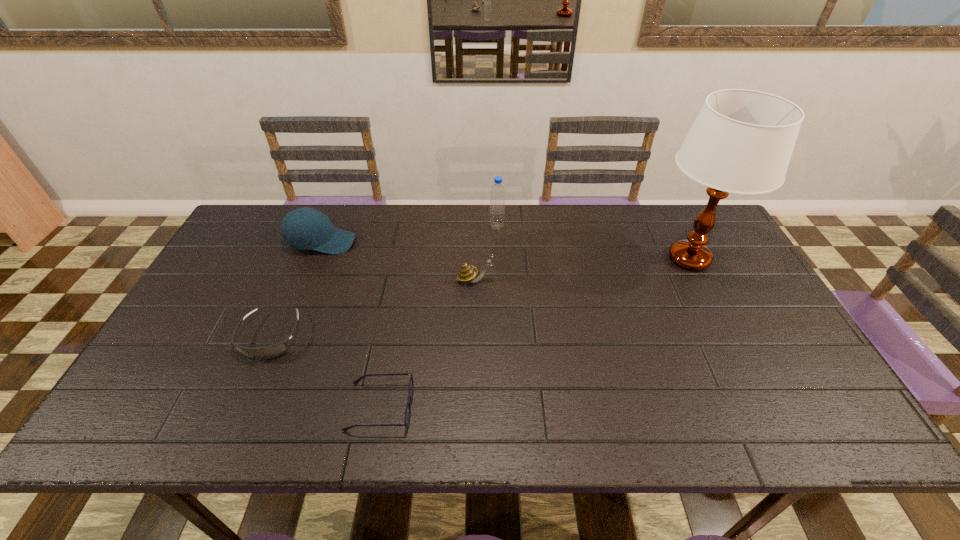
In order to click on table lamp in this screenshot , I will do `click(741, 142)`.

Where is `the rightmost object`? This screenshot has height=540, width=960. the rightmost object is located at coordinates (741, 142).

The height and width of the screenshot is (540, 960). In order to click on water bottle in this screenshot , I will do `click(497, 194)`.

Where is `baseball cap`? Image resolution: width=960 pixels, height=540 pixels. baseball cap is located at coordinates (305, 228).

I want to click on snail, so click(x=467, y=273).

You are a GUI agent. You are given a task and a screenshot of the screen. Output one action in this format:
    pyautogui.click(x=<x>, y=<y>)
    Task: Click on the second nearest object
    The height and width of the screenshot is (540, 960).
    Given the screenshot: What is the action you would take?
    pyautogui.click(x=271, y=351)

This screenshot has width=960, height=540. Identify the location of the nearest object. (407, 417).

The image size is (960, 540). Identify the location of spectacles. (407, 417).

The width and height of the screenshot is (960, 540). What are the coordinates of `free space located on the front of the rightmost object` in the screenshot? It's located at (764, 405).

This screenshot has width=960, height=540. I want to click on vacant space situated 0.050m on the left of the fifth shortest object, so click(x=474, y=226).